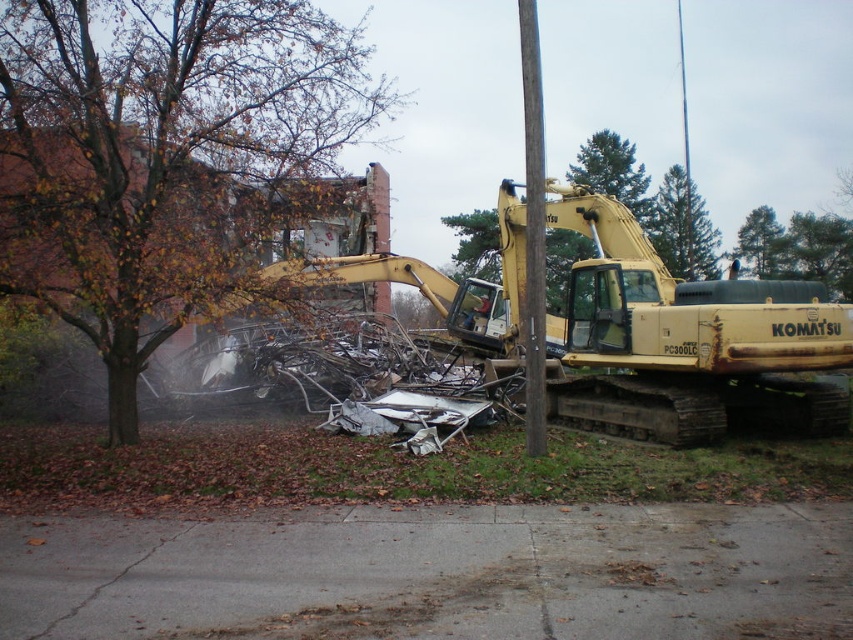
Question: Which of the following is the farthest from the observer?

Choices:
 (A) (473, 339)
 (B) (666, 173)
 (C) (828, 604)
 (D) (109, 280)

Answer: (B)

Question: Does yellow metallic excavator at center come behind brown wooden pole at center?

Choices:
 (A) yes
 (B) no

Answer: (A)

Question: Which object is farther from the camera taking this photo?

Choices:
 (A) brown wooden pole at center
 (B) green textured pine tree at upper center
 (C) gray asphalt pavement at lower center

Answer: (B)

Question: Does brown wooden pole at center have a lesser width compared to green leafy tree at upper right?

Choices:
 (A) yes
 (B) no

Answer: (B)

Question: From the image, what is the correct spatial relationship of gray asphalt pavement at lower center in relation to brown leafy tree at left?

Choices:
 (A) above
 (B) below

Answer: (B)

Question: Which object is the farthest from the green textured pine tree at upper center?

Choices:
 (A) gray asphalt pavement at lower center
 (B) brown leafy tree at left
 (C) green leafy tree at upper right

Answer: (A)